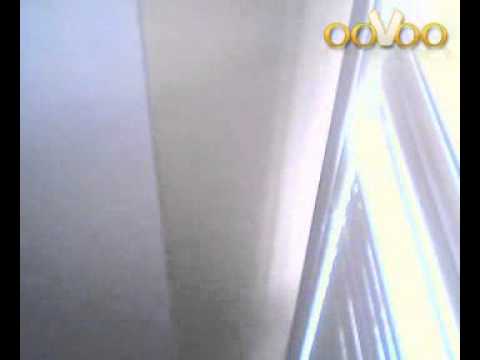
You are a GUI agent. You are given a task and a screenshot of the screen. Output one action in this format:
    pyautogui.click(x=<x>, y=<y>)
    Task: Click on the hook
    This screenshot has width=480, height=360.
    Given the screenshot: What is the action you would take?
    pyautogui.click(x=337, y=205)